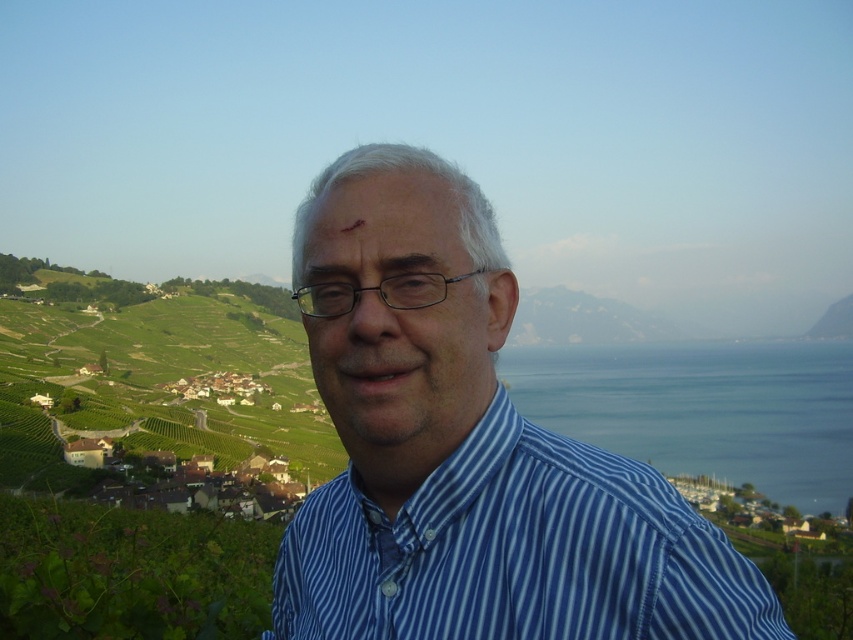
You are a photographer aiming to capture the person in the blue striped shirt at center and the blue water at right in a single frame. Based on their positions, which object will appear smaller in the photo?

The blue striped shirt at center will appear smaller in the photo because it has a lesser height compared to the blue water at right.

You are a photographer planning to capture the scenic view of the blue water at right and the matte skin at center. Which object occupies a wider area in the frame?

The blue water at right occupies a wider area in the frame than the matte skin at center because its width surpasses that of the matte skin at center.

You are a photographer trying to capture the person in the image. The person is standing at the center of the scene. There is a point marked at coordinate [467,451]. What object is located at this coordinate?

The point at coordinate [467,451] marks the blue striped shirt at center.